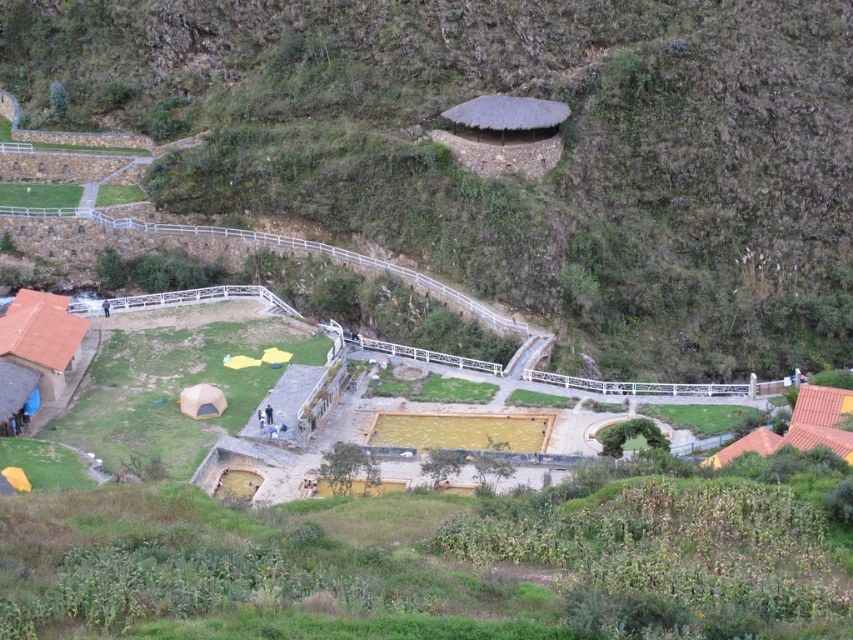
You are planning to set up a new tent in this outdoor area. You have two options available to choose from. The orange canvas tent at lower right and the matte yellow tent at lower center. Which tent is taller?

The matte yellow tent at lower center is taller than the orange canvas tent at lower right.

You are planning to set up a new bench in the scenic outdoor area. The bench requires 3 meters of space. You have two options for placement near the terracotta clay hut at lower left and the orange canvas tent at lower right. Which location has enough space for the bench?

The orange canvas tent at lower right has enough space because its width is greater than the terracotta clay hut at lower left, which may not provide sufficient space for the 3 meter bench.